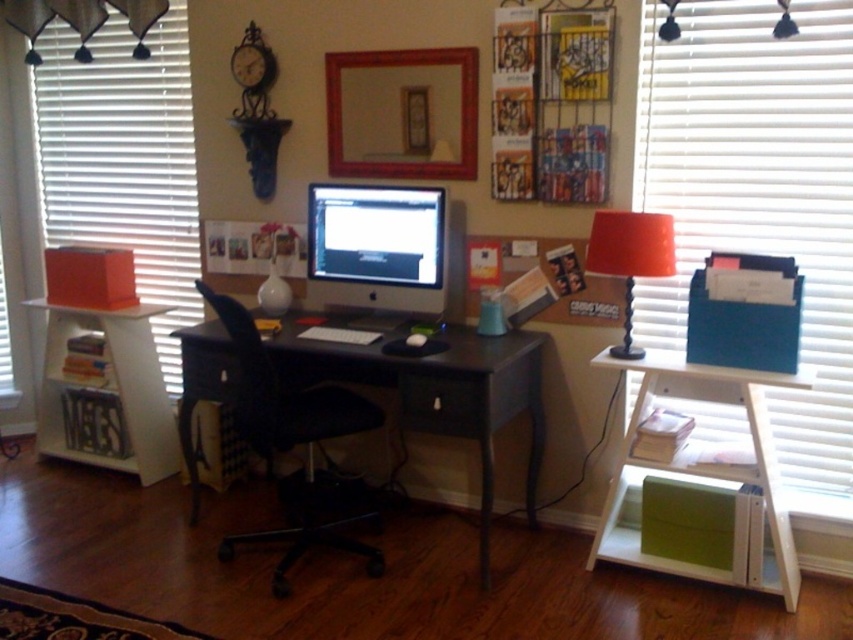
You are organizing a small plant that needs a spot near a window for sunlight. You have the white blinds at right and the black wood desk at center. Which object would provide better access to sunlight for the plant?

The white blinds at right would provide better access to sunlight for the plant since they are positioned near the window, allowing the plant to receive more natural light compared to the black wood desk at center which is centrally located in the room.

You are setting up a video call in the home office. You need to position yourself between the white blinds at right and the camera so that you are well lit. Can you stand exactly halfway between them to achieve this?

The white blinds at right and camera are 8.10 feet apart from each other. Standing exactly halfway would place you 4.05 feet from each, which should provide balanced lighting for the video call.

You are organizing a small party in the home office and need to place a 16 inch wide cake platter between the black wood desk at center and the satin black monitor at center. Will there be enough space for the cake platter between them?

The black wood desk at center is 15.25 inches away from the satin black monitor at center. Since the cake platter is 16 inches wide, there isn